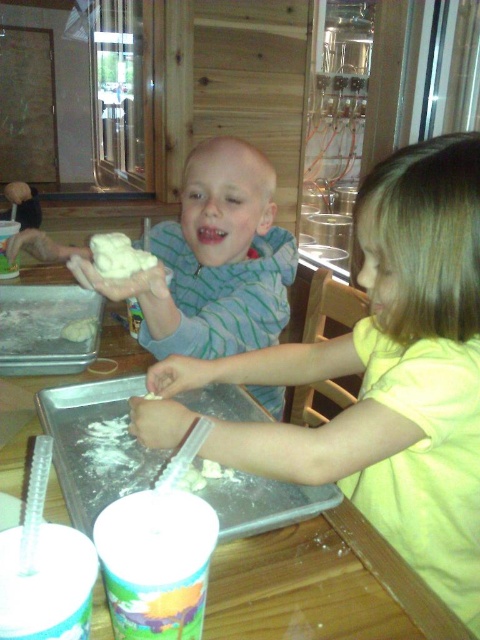
Question: Does white dough at upper center appear on the right side of white flour at center?

Choices:
 (A) no
 (B) yes

Answer: (B)

Question: Based on their relative distances, which object is nearer to the white dough at upper center?

Choices:
 (A) white fluffy dough at center
 (B) white flour at center
 (C) smooth white dough at center

Answer: (A)

Question: Does white dough at upper center come in front of white flour at center?

Choices:
 (A) yes
 (B) no

Answer: (A)

Question: Which object is positioned closest to the white dough at upper center?

Choices:
 (A) white fluffy dough at center
 (B) white flour at center

Answer: (A)

Question: Can you confirm if smooth white dough at center is smaller than white flour at center?

Choices:
 (A) no
 (B) yes

Answer: (A)

Question: Which point is farther to the camera?

Choices:
 (A) (454, 608)
 (B) (132, 273)
 (C) (158, 394)

Answer: (C)